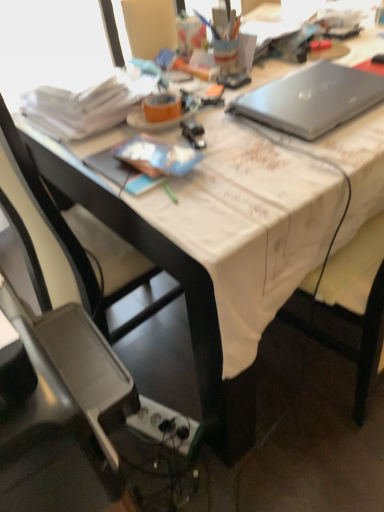
Where is `empty space that is in between silver metallic laptop at upper right and metallic silver stapler at center`? This screenshot has width=384, height=512. empty space that is in between silver metallic laptop at upper right and metallic silver stapler at center is located at coordinates (243, 133).